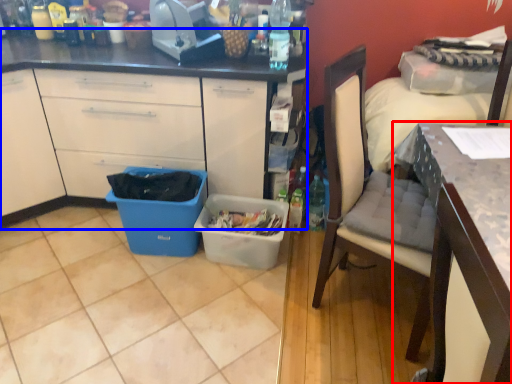
Question: Which object appears farthest to the camera in this image, desk (highlighted by a red box) or cabinetry (highlighted by a blue box)?

Choices:
 (A) desk
 (B) cabinetry

Answer: (B)